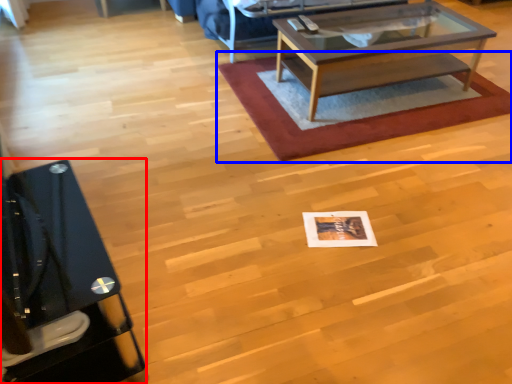
Question: Which point is further to the camera, desk (highlighted by a red box) or mat (highlighted by a blue box)?

Choices:
 (A) desk
 (B) mat

Answer: (B)